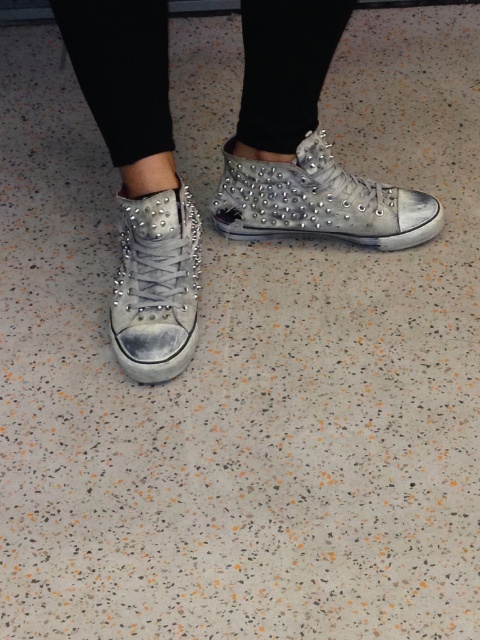
Question: Estimate the real-world distances between objects in this image. Which object is farther from the silver studded sneaker at center?

Choices:
 (A) distressed white leather sneaker at center
 (B) distressed white sneakers at center

Answer: (A)

Question: Which of the following is the farthest from the observer?

Choices:
 (A) distressed white leather sneaker at center
 (B) distressed white sneakers at center

Answer: (A)

Question: Does distressed white sneakers at center have a lesser width compared to silver studded sneaker at center?

Choices:
 (A) no
 (B) yes

Answer: (A)

Question: In this image, where is silver studded sneaker at center located relative to distressed white leather sneaker at center?

Choices:
 (A) left
 (B) right

Answer: (B)

Question: Can you confirm if distressed white sneakers at center is thinner than silver studded sneaker at center?

Choices:
 (A) no
 (B) yes

Answer: (A)

Question: Which point is closer to the camera?

Choices:
 (A) silver studded sneaker at center
 (B) distressed white sneakers at center
 (C) distressed white leather sneaker at center

Answer: (B)